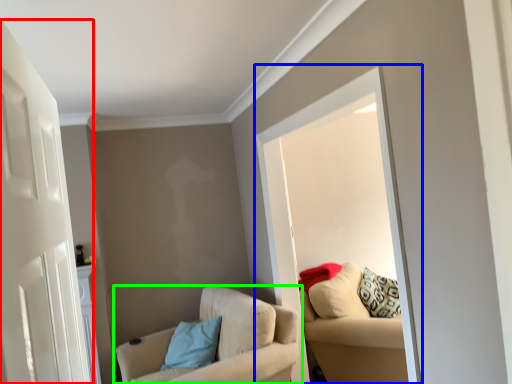
Question: Which is farther away from door (highlighted by a red box)? window (highlighted by a blue box) or chair (highlighted by a green box)?

Choices:
 (A) window
 (B) chair

Answer: (B)